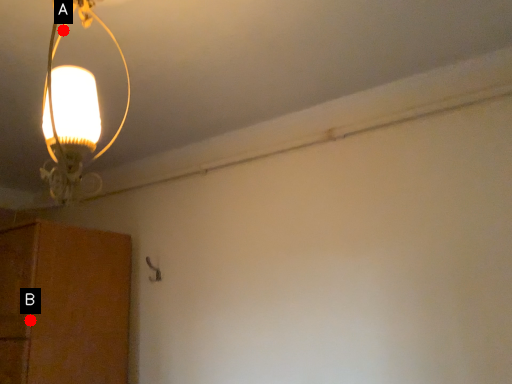
Question: Two points are circled on the image, labeled by A and B beside each circle. Which point appears closest to the camera in this image?

Choices:
 (A) A is closer
 (B) B is closer

Answer: (A)